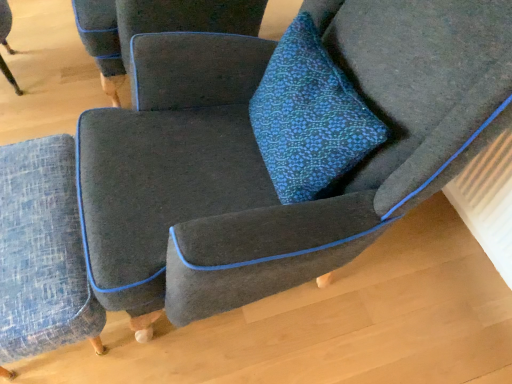
Question: In terms of size, does blue textured ottoman at lower left, the second chair positioned from the top, appear bigger or smaller than blue textured cushion at center?

Choices:
 (A) small
 (B) big

Answer: (B)

Question: From a real-world perspective, is blue textured ottoman at lower left, the second chair positioned from the top, physically located above or below blue textured cushion at center?

Choices:
 (A) above
 (B) below

Answer: (B)

Question: Estimate the real-world distances between objects in this image. Which object is closer to the blue textured ottoman at lower left, the second chair positioned from the top?

Choices:
 (A) blue textured cushion at center
 (B) textured gray armchair at center, the 1th chair when ordered from top to bottom

Answer: (B)

Question: Which object is positioned farthest from the blue textured cushion at center?

Choices:
 (A) textured gray armchair at center, which appears as the 2th chair when ordered from the bottom
 (B) blue textured ottoman at lower left, the second chair positioned from the top

Answer: (A)